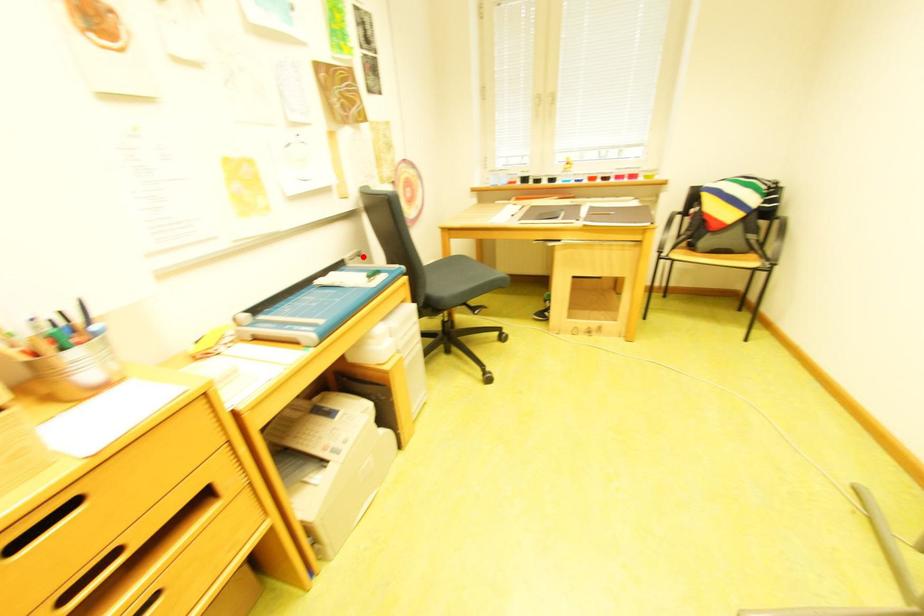
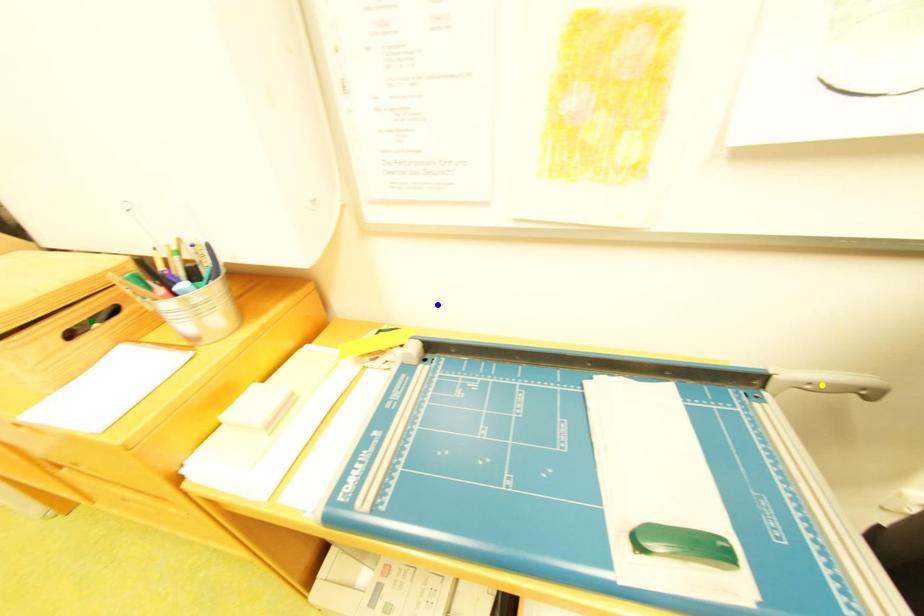
Question: I am providing you with two images of the same scene from different viewpoints. A red point is marked on the first image. You are given multiple points on the second image. Which point in image 2 is actually the same real-world point as the red point in image 1?

Choices:
 (A) blue point
 (B) yellow point
 (C) green point

Answer: (B)